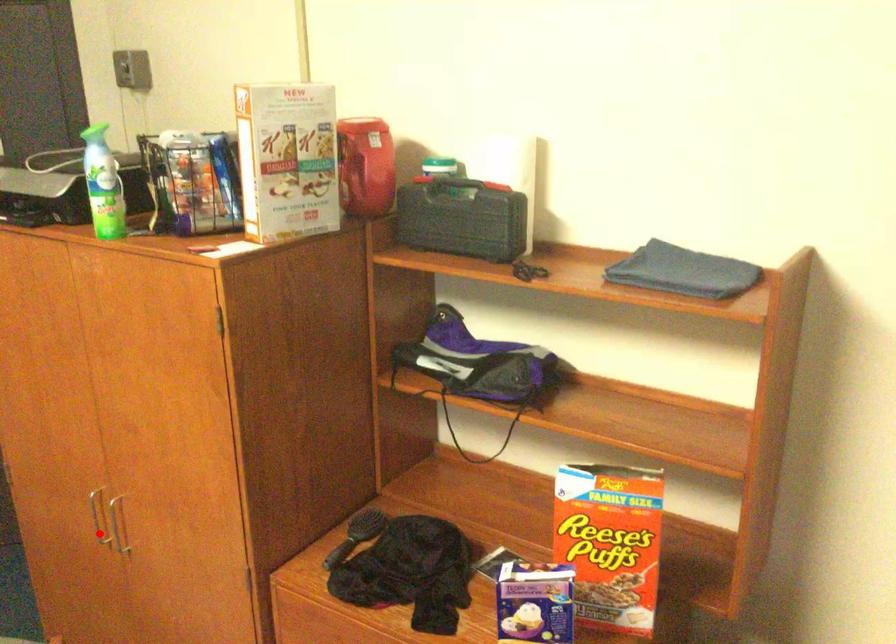
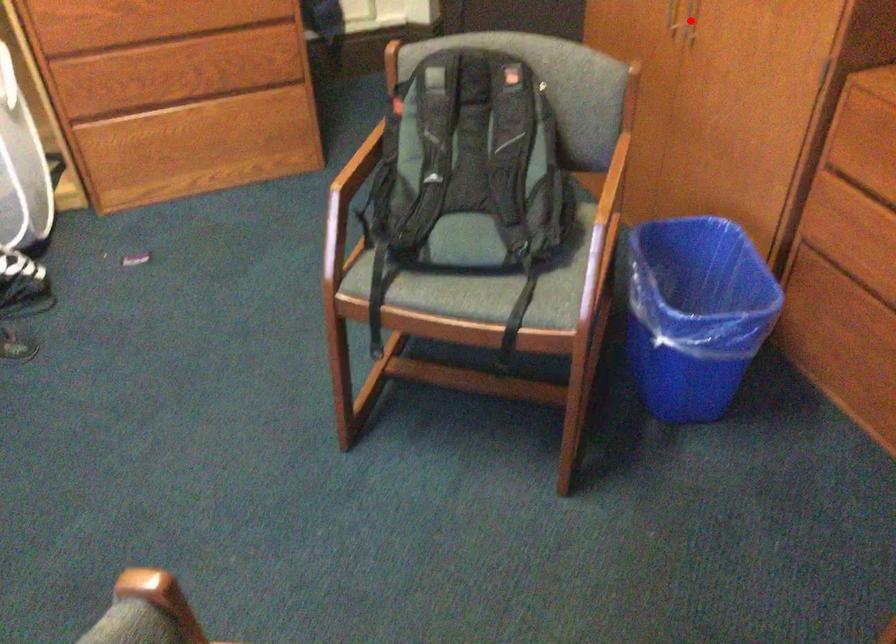
I am providing you with two images of the same scene from different viewpoints. A red point is marked on the first image and another point is marked on the second image. Do the highlighted points in image1 and image2 indicate the same real-world spot?

No